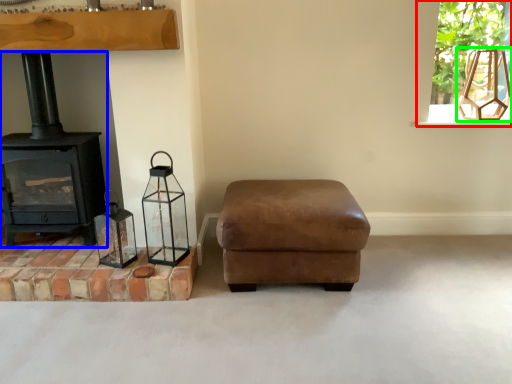
Question: Which is farther away from window frame (highlighted by a red box)? wood burning stove (highlighted by a blue box) or lamp (highlighted by a green box)?

Choices:
 (A) wood burning stove
 (B) lamp

Answer: (A)